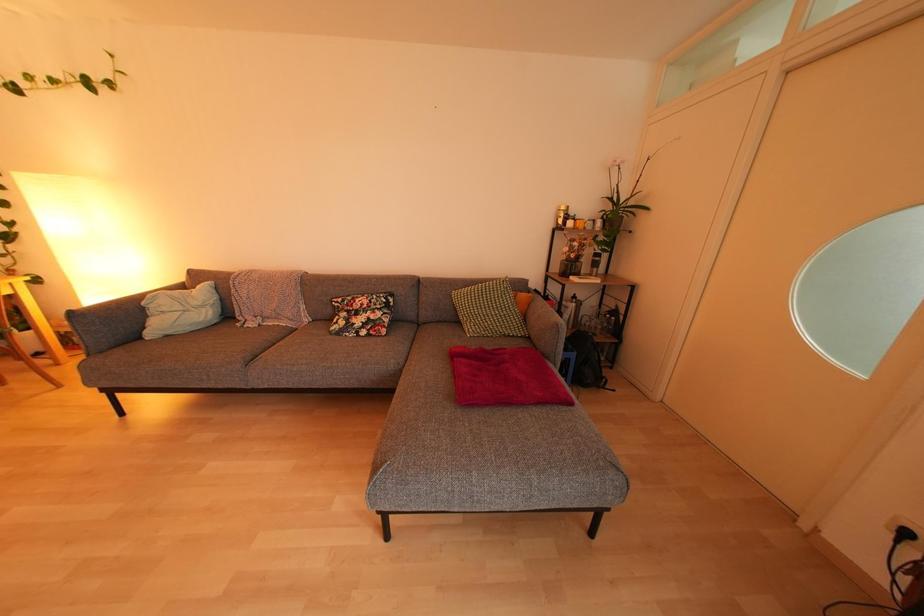
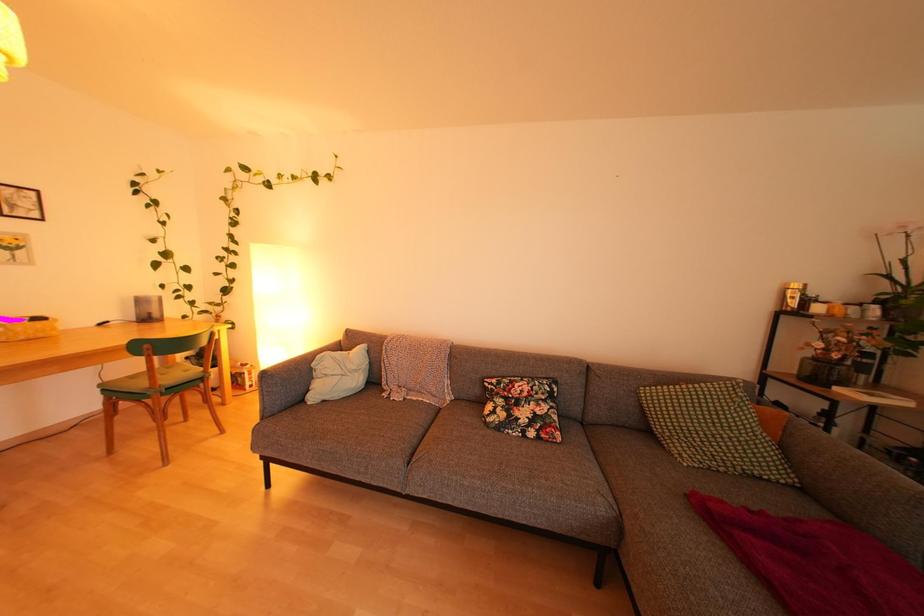
Question: In a continuous first-person perspective shot, in which direction is the camera moving?

Choices:
 (A) Left
 (B) Right
 (C) Forward
 (D) Backward

Answer: (A)